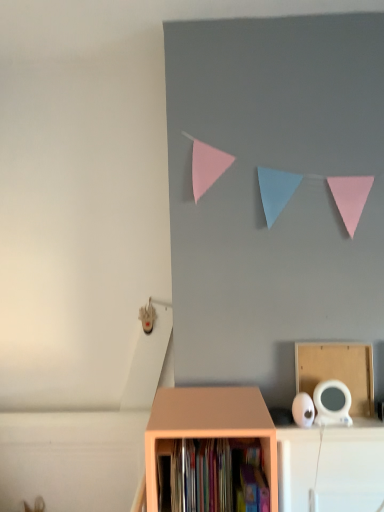
The height and width of the screenshot is (512, 384). What are the coordinates of `free point above matte wood shelf at lower center (from a real-world perspective)` in the screenshot? It's located at (206, 406).